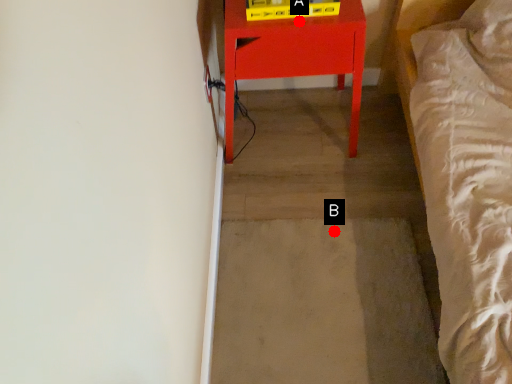
Question: Two points are circled on the image, labeled by A and B beside each circle. Which point appears closest to the camera in this image?

Choices:
 (A) A is closer
 (B) B is closer

Answer: (A)